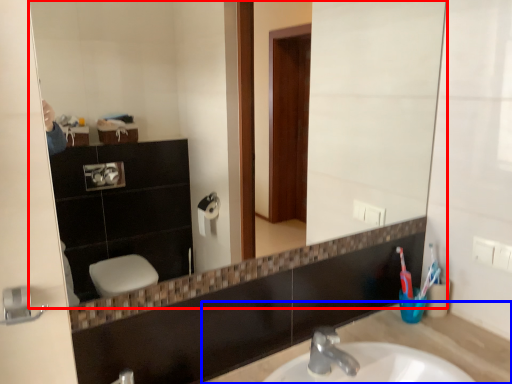
Question: Which object appears farthest to the camera in this image, mirror (highlighted by a red box) or counter top (highlighted by a blue box)?

Choices:
 (A) mirror
 (B) counter top

Answer: (B)